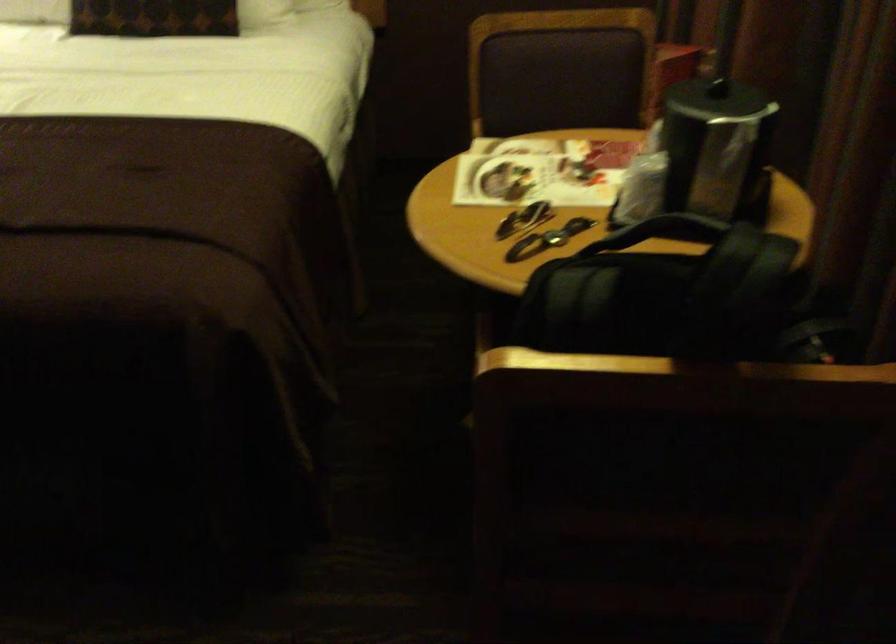
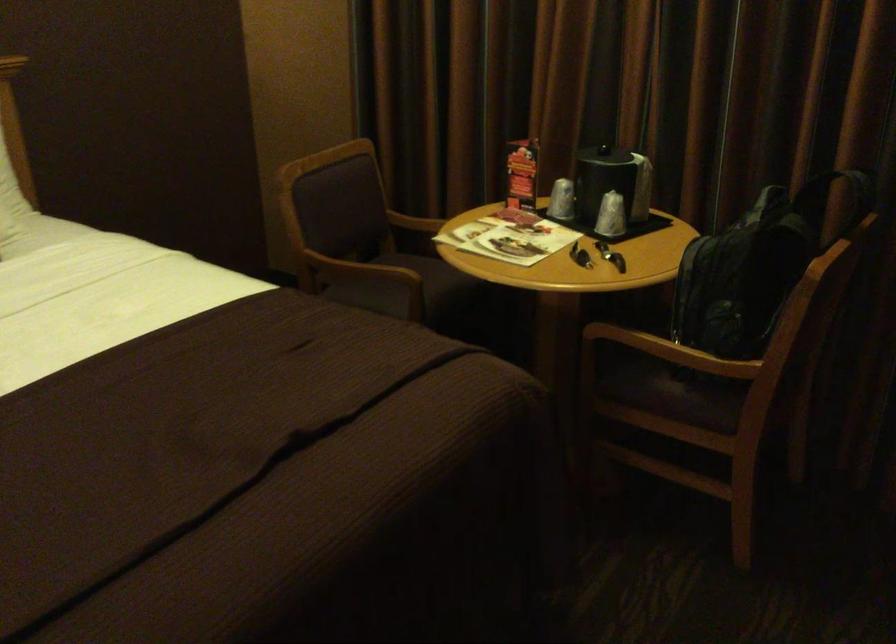
Find the pixel in the second image that matches (x=651, y=187) in the first image.

(610, 216)